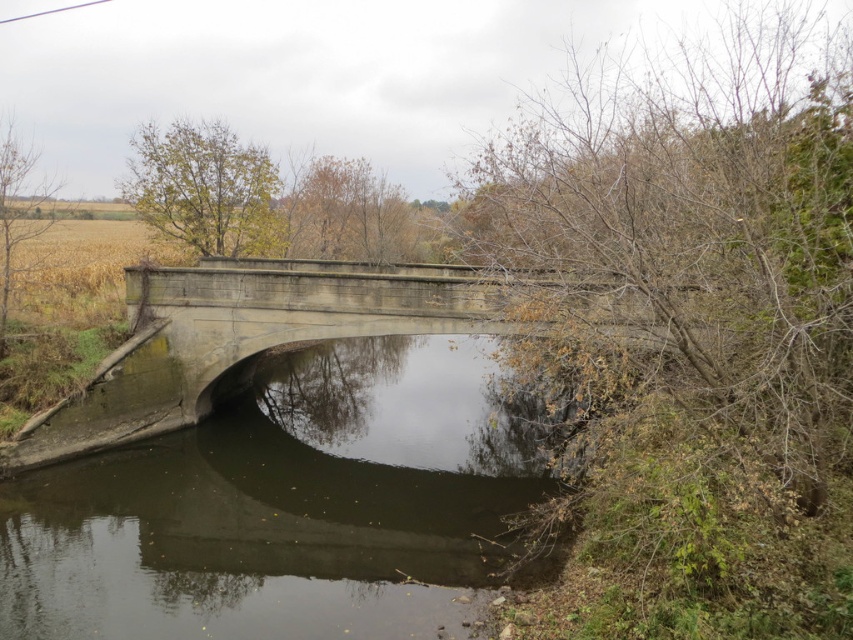
Can you confirm if dark gray concrete river at center is thinner than gray concrete bridge at center?

No, dark gray concrete river at center is not thinner than gray concrete bridge at center.

Where is `dark gray concrete river at center`? Image resolution: width=853 pixels, height=640 pixels. dark gray concrete river at center is located at coordinates (288, 506).

Image resolution: width=853 pixels, height=640 pixels. I want to click on dark gray concrete river at center, so click(x=288, y=506).